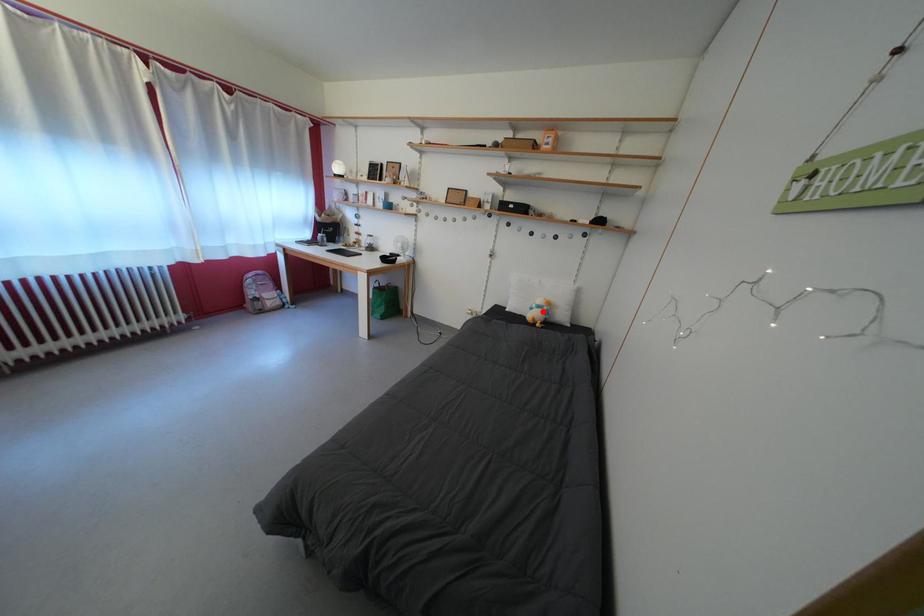
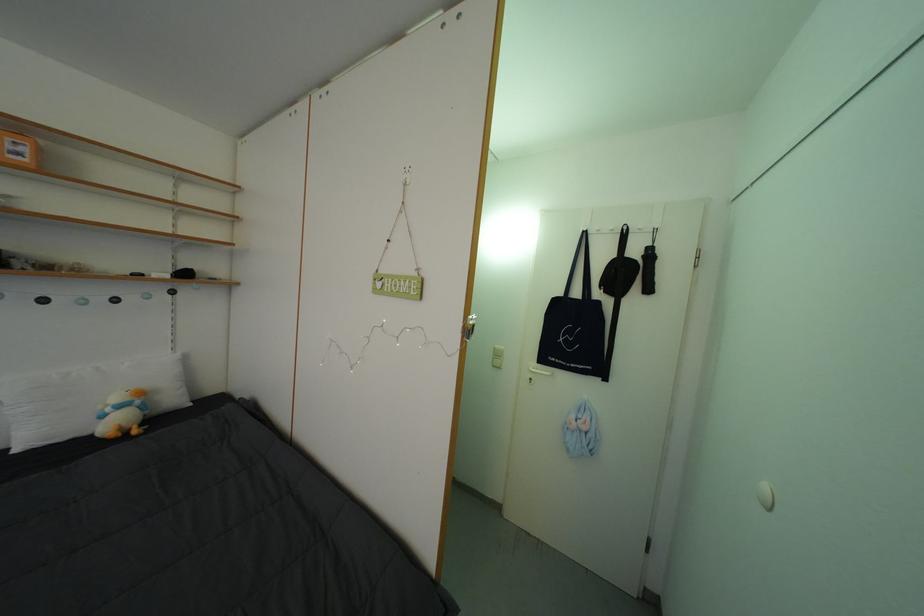
Question: I am providing you with two images of the same scene from different viewpoints. In image1, a red point is highlighted. Considering the same 3D point in image2, which of the following is correct?

Choices:
 (A) It is closer
 (B) It is farther

Answer: (A)